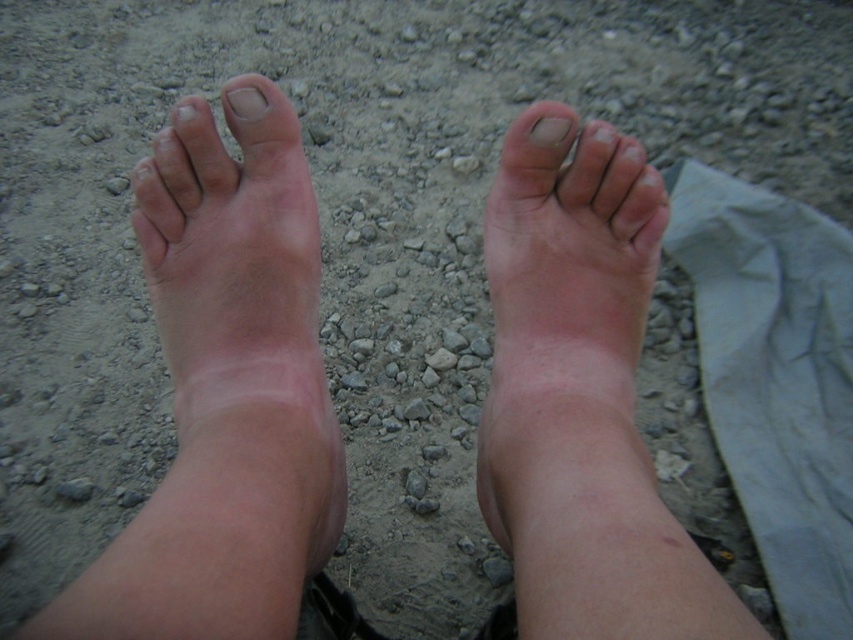
You are a foot care specialist examining the feet in the image. You need to apply a medicated pad between the pink skin at center and the nail at center. The pad is 8 inches long. Is there enough space to place the pad between them?

The distance between the pink skin at center and the nail at center is 8.56 inches. Since the pad is 8 inches long, there is sufficient space to place the pad between them.

You are a dermatologist examining the image of two bare feet on a rocky surface. You notice the pink smooth skin at center and the nail at center. Based on the spatial relationship between them, which one is wider?

The pink smooth skin at center might be wider than nail at center according to the description.

You are a dermatologist examining the image of two feet on a rocky surface. You notice the pink smooth skin at center and the nail at center. Which of these two features is larger in size?

The pink smooth skin at center is bigger than the nail at center.